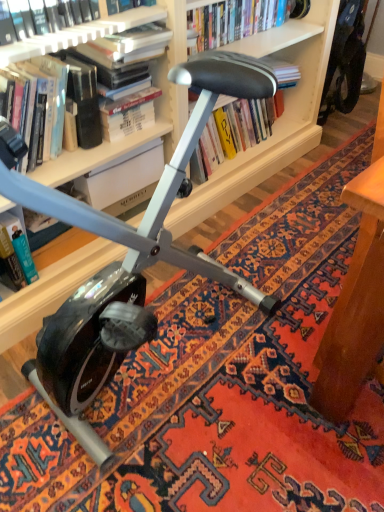
Question: Can you confirm if hardcover book at center, positioned as the 1th book in right-to-left order, is smaller than hardcover book at left, the first book positioned from the left?

Choices:
 (A) no
 (B) yes

Answer: (A)

Question: Are hardcover book at center, positioned as the 1th book in right-to-left order, and hardcover book at left, which is counted as the 4th book, starting from the right, beside each other?

Choices:
 (A) yes
 (B) no

Answer: (B)

Question: Is hardcover book at center, which appears as the fourth book when viewed from the left, to the left of hardcover book at left, which is counted as the 4th book, starting from the right, from the viewer's perspective?

Choices:
 (A) yes
 (B) no

Answer: (B)

Question: Is hardcover book at center, positioned as the 1th book in right-to-left order, facing away from hardcover book at left, the first book positioned from the left?

Choices:
 (A) no
 (B) yes

Answer: (A)

Question: Does hardcover book at center, positioned as the 1th book in right-to-left order, have a greater width compared to hardcover book at left, which is counted as the 4th book, starting from the right?

Choices:
 (A) no
 (B) yes

Answer: (B)

Question: From the image's perspective, is matte white bookcase at upper center above or below hardcover book at left, the first book positioned from the left?

Choices:
 (A) below
 (B) above

Answer: (B)

Question: Is matte white bookcase at upper center situated inside hardcover book at left, the first book positioned from the left, or outside?

Choices:
 (A) inside
 (B) outside

Answer: (B)

Question: Is matte white bookcase at upper center in front of or behind hardcover book at left, the first book positioned from the left, in the image?

Choices:
 (A) behind
 (B) front

Answer: (B)

Question: From a real-world perspective, relative to hardcover book at left, which is counted as the 4th book, starting from the right, is matte white bookcase at upper center vertically above or below?

Choices:
 (A) above
 (B) below

Answer: (A)

Question: Is point (16, 288) closer or farther from the camera than point (109, 194)?

Choices:
 (A) farther
 (B) closer

Answer: (B)

Question: From the image's perspective, is hardcover book at left, which is counted as the 4th book, starting from the right, above or below hardcover book at center?

Choices:
 (A) above
 (B) below

Answer: (B)

Question: In terms of size, does hardcover book at left, the first book positioned from the left, appear bigger or smaller than hardcover book at center?

Choices:
 (A) big
 (B) small

Answer: (B)

Question: In the image, is hardcover book at left, which is counted as the 4th book, starting from the right, on the left side or the right side of hardcover book at center?

Choices:
 (A) right
 (B) left

Answer: (B)

Question: Considering the positions of hardcover book at upper center, which appears as the second book when viewed from the right, and hardcover book at upper left, the second book when ordered from left to right, in the image, is hardcover book at upper center, which appears as the second book when viewed from the right, bigger or smaller than hardcover book at upper left, the second book when ordered from left to right,?

Choices:
 (A) small
 (B) big

Answer: (A)

Question: Is hardcover book at upper center, which appears as the second book when viewed from the right, inside the boundaries of hardcover book at upper left, the second book when ordered from left to right, or outside?

Choices:
 (A) inside
 (B) outside

Answer: (B)